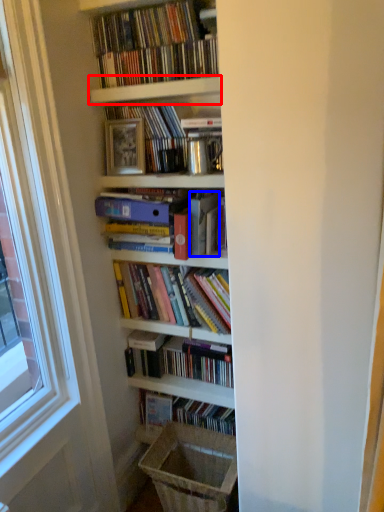
Question: Among these objects, which one is farthest to the camera, shelf (highlighted by a red box) or paperback book (highlighted by a blue box)?

Choices:
 (A) shelf
 (B) paperback book

Answer: (B)